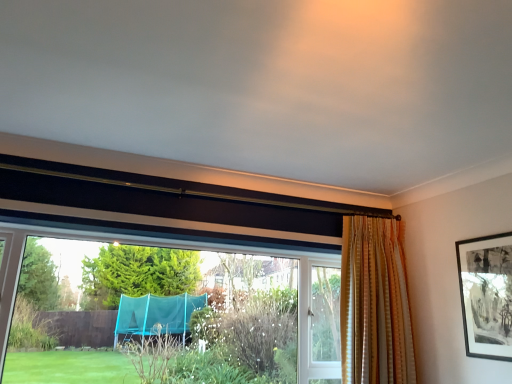
Question: Are transparent plastic trampoline at lower left and black matte picture frame at upper right making contact?

Choices:
 (A) no
 (B) yes

Answer: (A)

Question: Is transparent plastic trampoline at lower left to the right of black matte picture frame at upper right from the viewer's perspective?

Choices:
 (A) no
 (B) yes

Answer: (A)

Question: Does transparent plastic trampoline at lower left lie in front of black matte picture frame at upper right?

Choices:
 (A) no
 (B) yes

Answer: (B)

Question: From a real-world perspective, does transparent plastic trampoline at lower left sit lower than black matte picture frame at upper right?

Choices:
 (A) yes
 (B) no

Answer: (A)

Question: From a real-world perspective, does transparent plastic trampoline at lower left stand above black matte picture frame at upper right?

Choices:
 (A) no
 (B) yes

Answer: (A)

Question: In the image, is black matte picture frame at upper right on the left side or the right side of transparent plastic trampoline at lower left?

Choices:
 (A) right
 (B) left

Answer: (A)

Question: In terms of width, does black matte picture frame at upper right look wider or thinner when compared to transparent plastic trampoline at lower left?

Choices:
 (A) wide
 (B) thin

Answer: (B)

Question: From a real-world perspective, is black matte picture frame at upper right above or below transparent plastic trampoline at lower left?

Choices:
 (A) above
 (B) below

Answer: (A)

Question: Which is correct: black matte picture frame at upper right is inside transparent plastic trampoline at lower left, or outside of it?

Choices:
 (A) inside
 (B) outside

Answer: (B)

Question: From a real-world perspective, relative to striped fabric curtain at right, is transparent plastic trampoline at lower left vertically above or below?

Choices:
 (A) below
 (B) above

Answer: (A)

Question: Considering the positions of transparent plastic trampoline at lower left and striped fabric curtain at right in the image, is transparent plastic trampoline at lower left wider or thinner than striped fabric curtain at right?

Choices:
 (A) thin
 (B) wide

Answer: (B)

Question: Does point (211, 286) appear closer or farther from the camera than point (389, 261)?

Choices:
 (A) farther
 (B) closer

Answer: (A)

Question: Considering their positions, is transparent plastic trampoline at lower left located in front of or behind striped fabric curtain at right?

Choices:
 (A) behind
 (B) front

Answer: (B)

Question: Looking at their shapes, would you say black matte picture frame at upper right is wider or thinner than striped fabric curtain at right?

Choices:
 (A) thin
 (B) wide

Answer: (A)

Question: Is point (472, 344) positioned closer to the camera than point (394, 236)?

Choices:
 (A) farther
 (B) closer

Answer: (B)